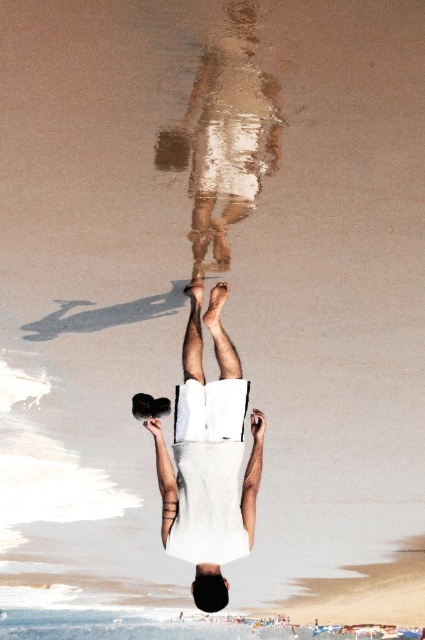
Question: Is smooth white skin at center smaller than shiny metallic legs at center?

Choices:
 (A) no
 (B) yes

Answer: (A)

Question: Is smooth white skin at center to the right of shiny metallic legs at center from the viewer's perspective?

Choices:
 (A) no
 (B) yes

Answer: (A)

Question: In this image, where is smooth white skin at center located relative to shiny metallic legs at center?

Choices:
 (A) right
 (B) left

Answer: (B)

Question: Which of the following is the closest to the observer?

Choices:
 (A) (240, 394)
 (B) (244, 28)

Answer: (B)

Question: Which point is farther from the camera taking this photo?

Choices:
 (A) (193, 428)
 (B) (252, 86)

Answer: (A)

Question: Which point is farther to the camera?

Choices:
 (A) smooth white skin at center
 (B) shiny metallic legs at center

Answer: (A)